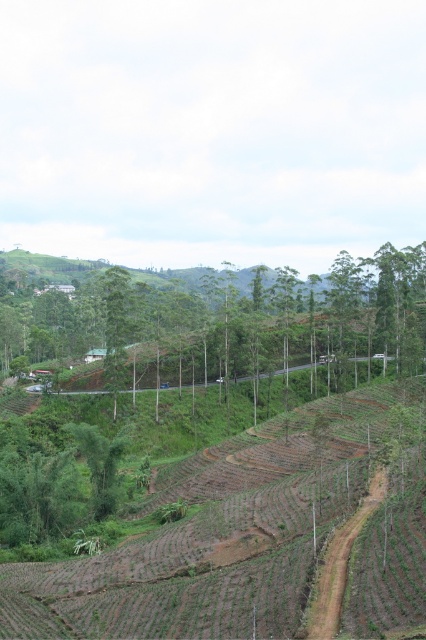
Between point (199, 296) and point (348, 525), which one is positioned behind?

The point (199, 296) is behind.

Is green leafy tree at center wider than brown dirt track at center-right?

Yes, green leafy tree at center is wider than brown dirt track at center-right.

Between point (224, 307) and point (351, 515), which one is positioned in front?

Point (351, 515) is in front.

This screenshot has height=640, width=426. In order to click on green leafy tree at center in this screenshot , I will do `click(218, 320)`.